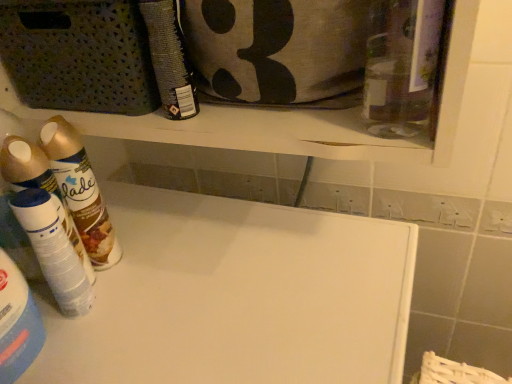
This screenshot has width=512, height=384. Identify the location of free space above white matte board at center (from a real-world perspective). (202, 276).